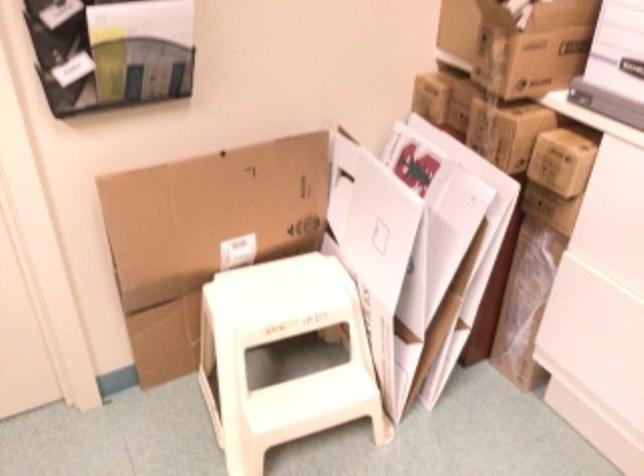
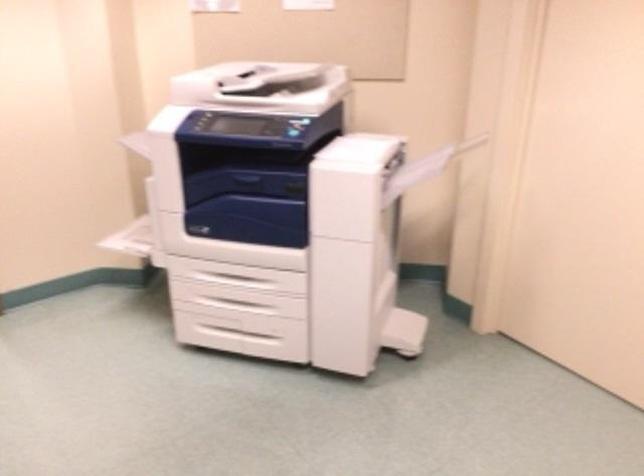
Question: The camera is either moving clockwise (left) or counter-clockwise (right) around the object. The first image is from the beginning of the video and the second image is from the end. Is the camera moving left or right when shooting the video?

Choices:
 (A) Left
 (B) Right

Answer: (B)